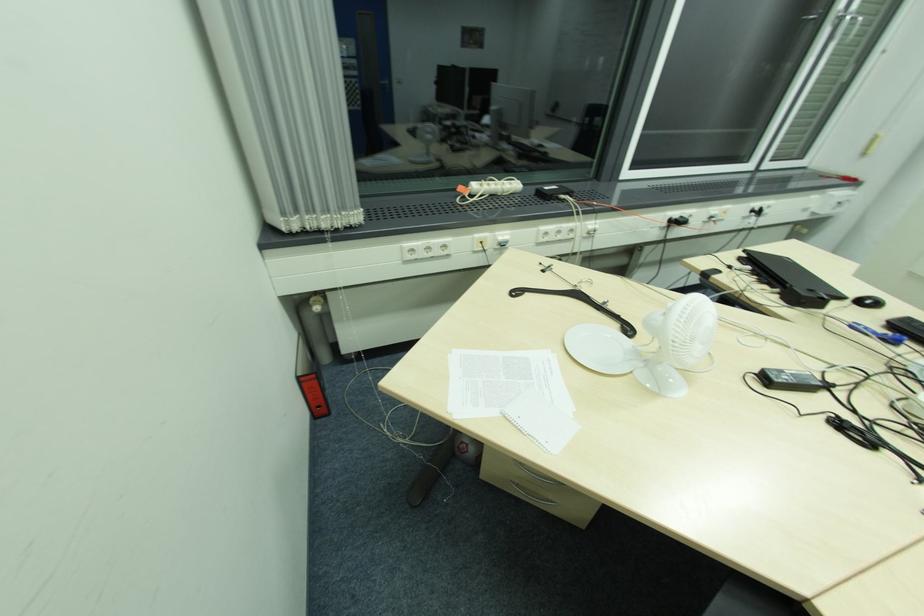
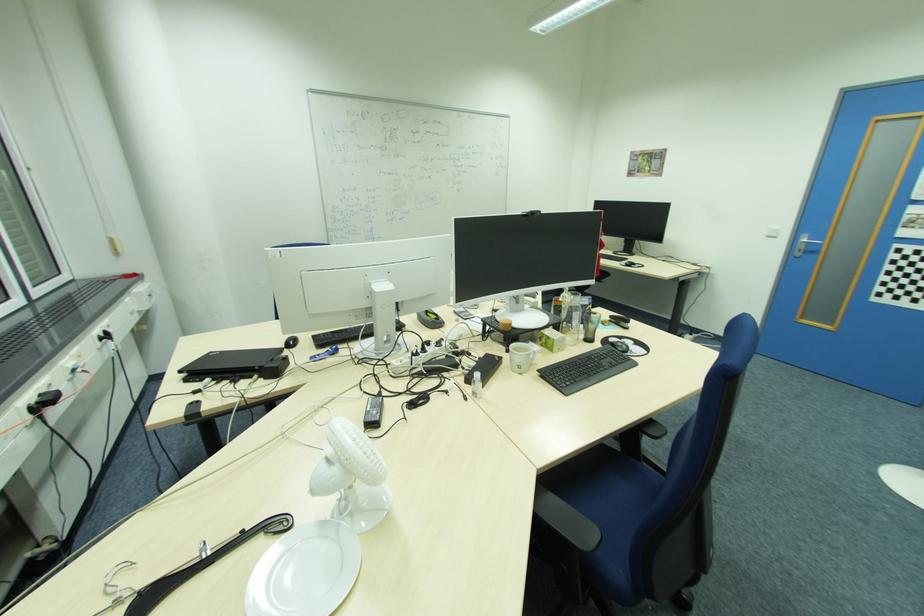
In the second image, find the point that corresponds to the point at 748,251 in the first image.

(183, 371)